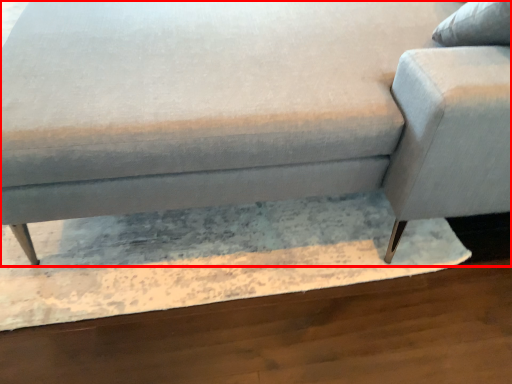
Question: From the image's perspective, where is studio couch (annotated by the red box) located relative to swivel chair?

Choices:
 (A) above
 (B) below

Answer: (A)